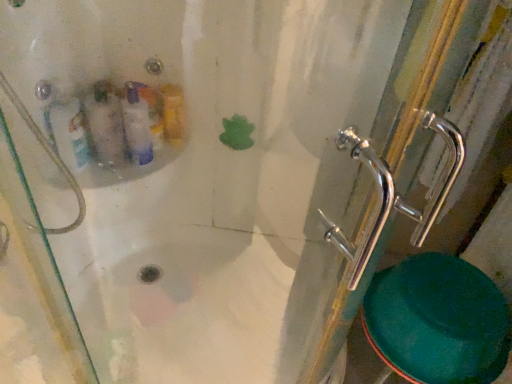
The width and height of the screenshot is (512, 384). I want to click on teal rubber potty at lower right, so click(x=438, y=321).

Image resolution: width=512 pixels, height=384 pixels. What do you see at coordinates (438, 321) in the screenshot?
I see `teal rubber potty at lower right` at bounding box center [438, 321].

At what (x,y) coordinates should I click in order to perform the action: click on teal rubber potty at lower right. Please return your answer as a coordinate pair (x, y). Image resolution: width=512 pixels, height=384 pixels. Looking at the image, I should click on (438, 321).